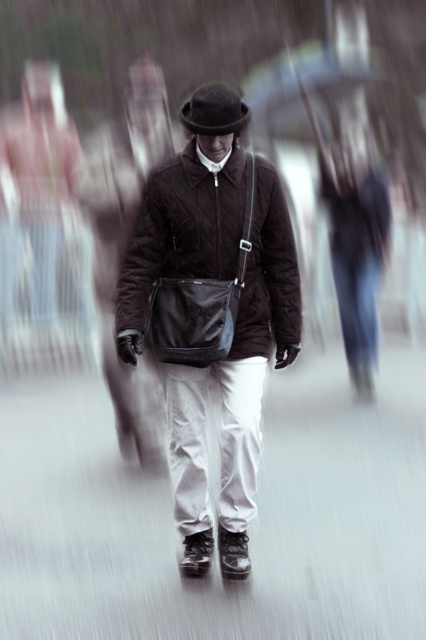
Question: Which object is closer to the camera taking this photo?

Choices:
 (A) matte black bag at center
 (B) black felt fedora at center
 (C) black matte jacket at center

Answer: (A)

Question: Is matte black bag at center below black matte jacket at center?

Choices:
 (A) yes
 (B) no

Answer: (A)

Question: In this image, where is black matte jacket at center located relative to black felt fedora at center?

Choices:
 (A) left
 (B) right

Answer: (A)

Question: Is white smooth pavement at center to the left of black matte jacket at center from the viewer's perspective?

Choices:
 (A) yes
 (B) no

Answer: (A)

Question: Which object is positioned farthest from the matte black bag at center?

Choices:
 (A) white smooth pavement at center
 (B) black matte jacket at center

Answer: (A)

Question: Considering the real-world distances, which object is closest to the black felt fedora at center?

Choices:
 (A) white smooth pavement at center
 (B) black matte jacket at center

Answer: (B)